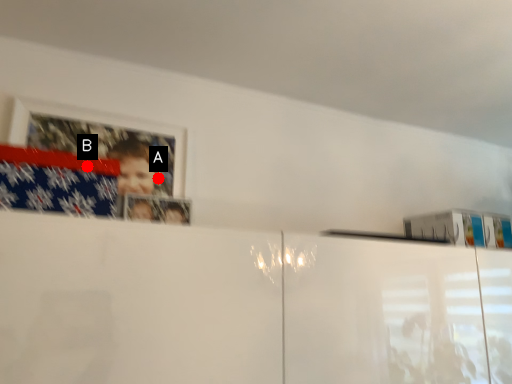
Question: Two points are circled on the image, labeled by A and B beside each circle. Which point is further to the camera?

Choices:
 (A) A is further
 (B) B is further

Answer: (A)